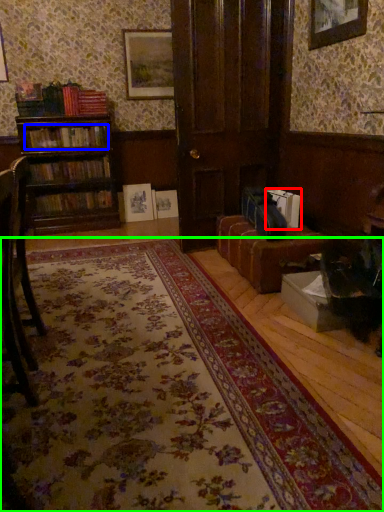
Question: Considering the real-world distances, which object is farthest from book (highlighted by a red box)? book (highlighted by a blue box) or mat (highlighted by a green box)?

Choices:
 (A) book
 (B) mat

Answer: (A)